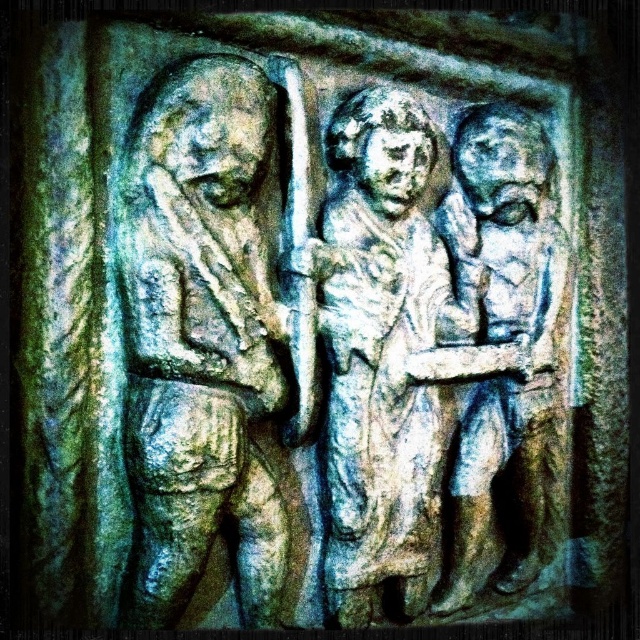
Based on the coordinates provided, which figure corresponds to the point labeled as point A at position (x=204, y=344)?

The carved stone figure at left corresponds to point A at position (x=204, y=344).